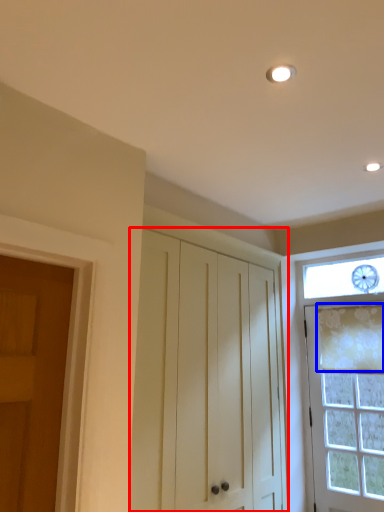
Question: Which object appears farthest to the camera in this image, cabinetry (highlighted by a red box) or curtain (highlighted by a blue box)?

Choices:
 (A) cabinetry
 (B) curtain

Answer: (B)